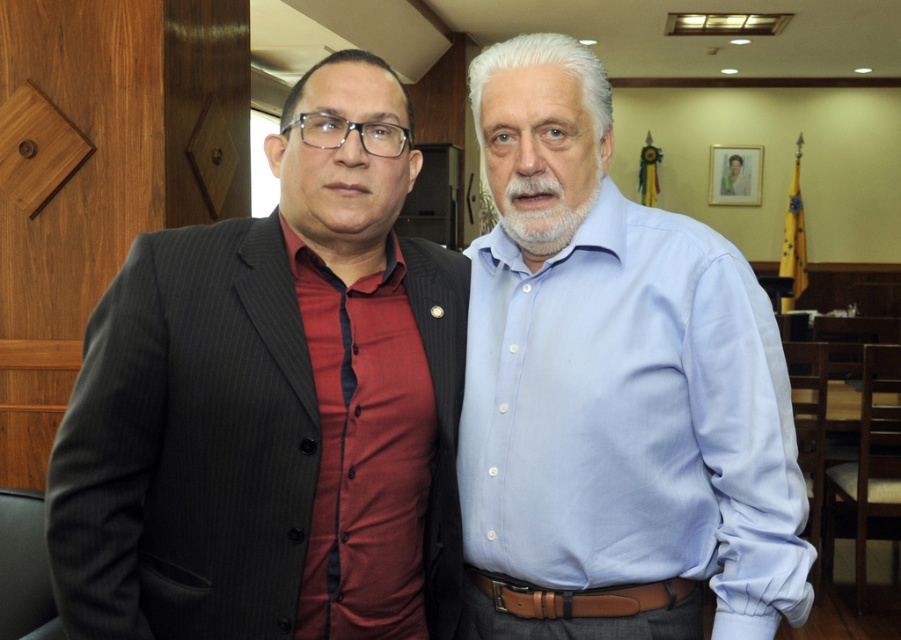
Question: Which of the following is the farthest from the observer?

Choices:
 (A) (119, 554)
 (B) (651, 451)

Answer: (B)

Question: Is light blue shirt at center to the right of matte black suit at left from the viewer's perspective?

Choices:
 (A) no
 (B) yes

Answer: (B)

Question: Which point appears farthest from the camera in this image?

Choices:
 (A) (217, 566)
 (B) (686, 586)

Answer: (B)

Question: Which point appears closest to the camera in this image?

Choices:
 (A) (516, 376)
 (B) (179, 458)

Answer: (B)

Question: Is light blue shirt at center wider than matte black suit at left?

Choices:
 (A) yes
 (B) no

Answer: (B)

Question: Is light blue shirt at center positioned in front of matte black suit at left?

Choices:
 (A) yes
 (B) no

Answer: (B)